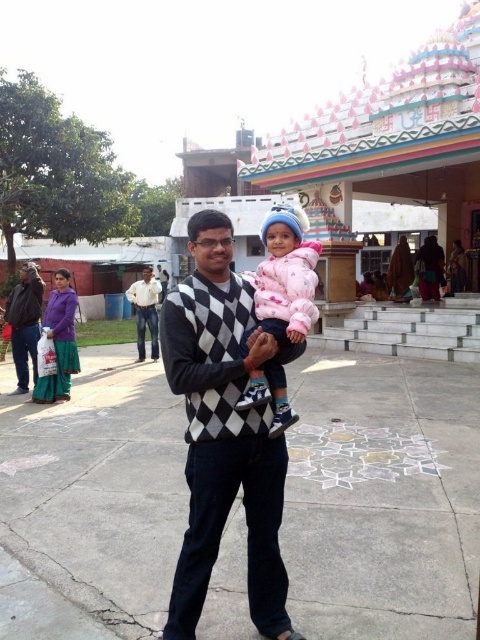
You are a photographer trying to capture a candid shot of the man and child in the temple scene. The pink fleece jacket at center and white cotton shirt at center are both in your camera frame. Which clothing item appears shorter in the photo?

The pink fleece jacket at center appears shorter than the white cotton shirt at center because it is not as tall as the white cotton shirt at center.